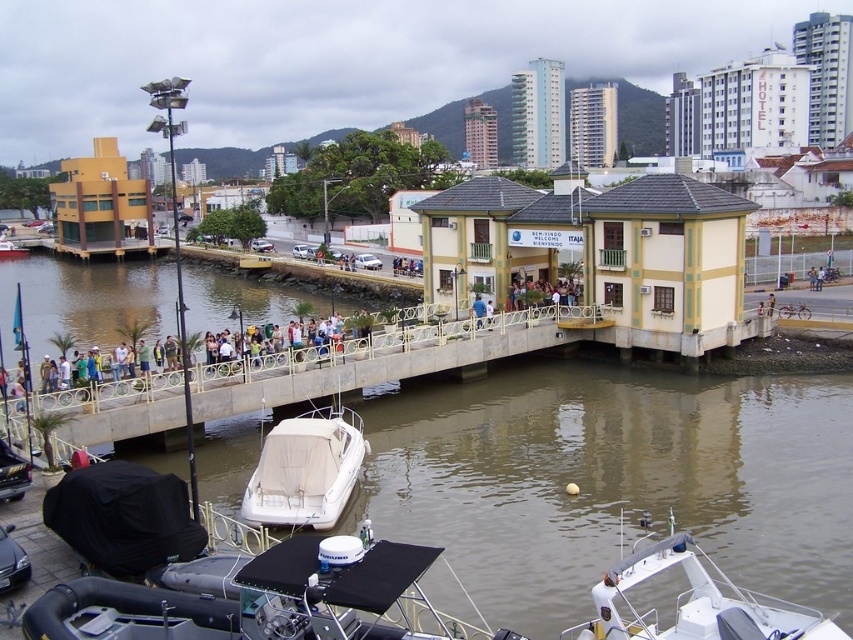
Which is in front, point (161, 387) or point (670, 634)?

Point (670, 634) is more forward.

Is white concrete dock at center positioned at the back of white matte boat at lower right?

That is True.

Is point (579, 308) positioned in front of point (817, 627)?

No.

At what (x,y) coordinates should I click in order to perform the action: click on white concrete dock at center. Please return your answer as a coordinate pair (x, y). Looking at the image, I should click on (381, 360).

Does brown murky water at center have a larger size compared to beige canvas boat at center?

Yes, brown murky water at center is bigger than beige canvas boat at center.

Is brown murky water at center positioned before beige canvas boat at center?

Yes, it is in front of beige canvas boat at center.

Is point (788, 554) closer to camera compared to point (258, 502)?

Yes, point (788, 554) is in front of point (258, 502).

Locate an element on the screen. The image size is (853, 640). brown murky water at center is located at coordinates (613, 480).

Between brown murky water at center and white matte boat at center, which one appears on the right side from the viewer's perspective?

brown murky water at center is more to the right.

Where is `brown murky water at center`? Image resolution: width=853 pixels, height=640 pixels. brown murky water at center is located at coordinates (613, 480).

You are a GUI agent. You are given a task and a screenshot of the screen. Output one action in this format:
    pyautogui.click(x=<x>, y=<y>)
    Task: Click on the brown murky water at center
    Image resolution: width=853 pixels, height=640 pixels.
    Given the screenshot: What is the action you would take?
    pyautogui.click(x=613, y=480)